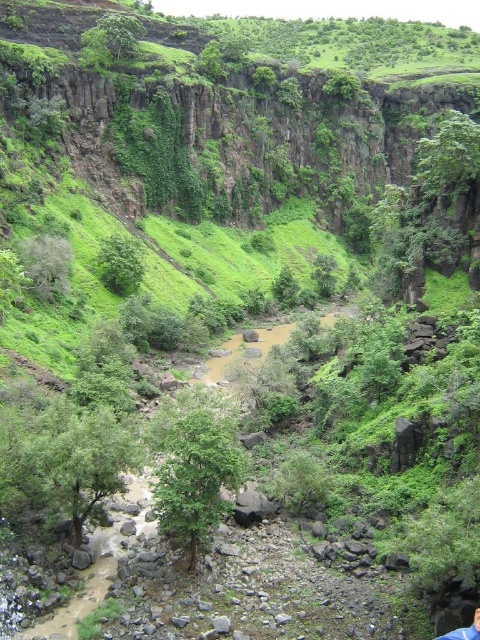
You are a hiker trying to navigate through the valley. You see a green leafy tree at center and a green leafy bush at center. Which one is larger in size?

The green leafy tree at center is bigger than the green leafy bush at center.

You are a hiker trying to cross the valley floor. You need to walk between the green leafy tree at center and the green leafy bush at center. Which one is wider, and will you have enough space to pass between them?

The green leafy tree at center is wider than the green leafy bush at center. Since the valley floor is rocky and uneven, you should carefully assess the space between them to ensure safe passage.